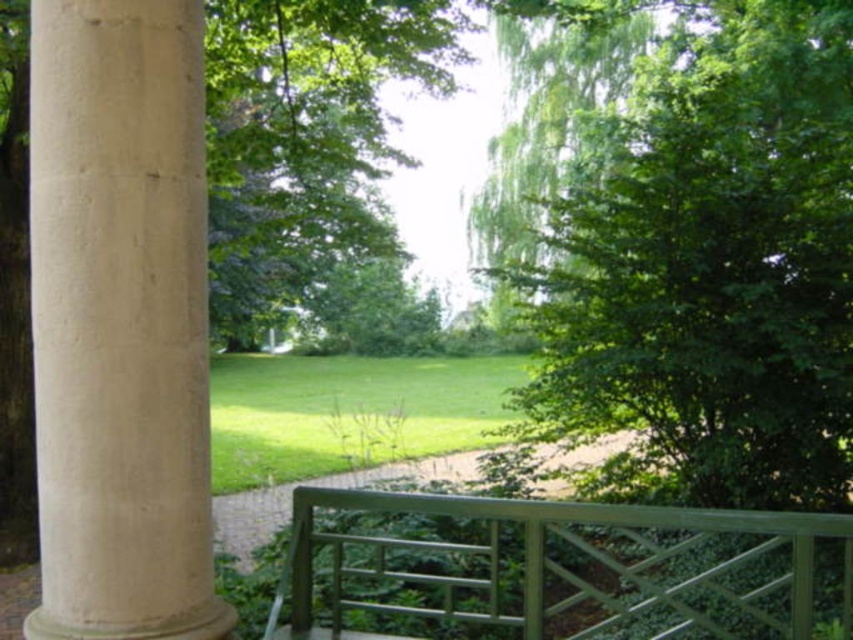
You are standing at the shaded area under the gazebo and see the green leafy tree at center and the green painted wood railing at center. Which object is positioned to the right of the other?

The green leafy tree at center is to the right of the green painted wood railing at center.

You are a landscape architect designing a new pathway between the green leafy tree at center and the beige stone column at left. The pathway requires a minimum of 30 feet of space. Can the existing distance accommodate this requirement?

The distance between the green leafy tree at center and the beige stone column at left is 30.74 feet, which exceeds the required 30 feet. Therefore, the existing distance can accommodate the pathway requirement.

You are standing at the entrance of the gazebo and see the green leafy tree at center and the beige stone column at left. Which object is closer to your right side?

The green leafy tree at center is positioned on the right side of beige stone column at left, so the green leafy tree at center is closer to your right side.